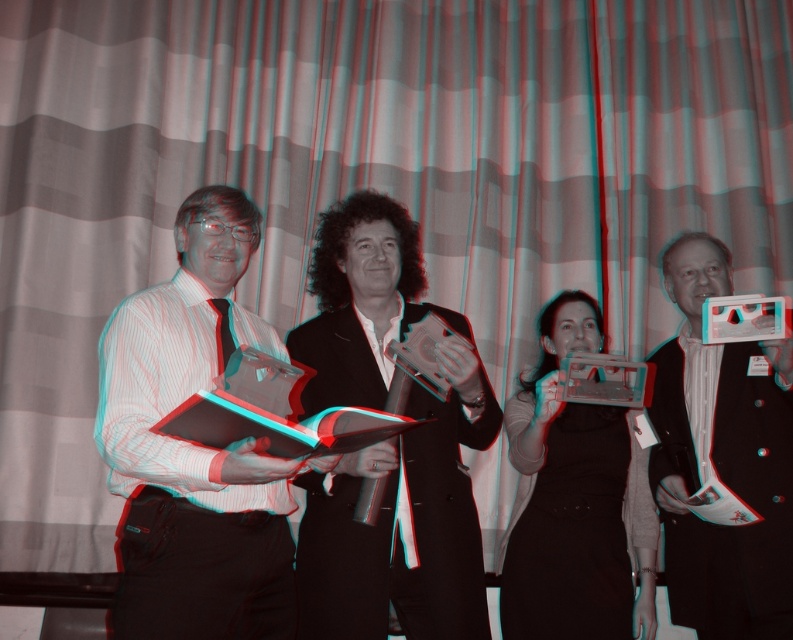
You are organizing a small exhibition and need to place the black glossy book at center and the shiny silver award at center on a shelf. Based on the image, which object should be placed to the left of the other?

The black glossy book at center should be placed to the left of the shiny silver award at center because in the image, the black glossy book at center is positioned on the left side of the shiny silver award at center.

You are organizing a photo shoot and need to ensure that the black glossy book at center and the matte black dress at center are positioned at least 20 inches apart for proper lighting. Based on the scene description, is their current distance sufficient?

The black glossy book at center is 17.21 inches away from matte black dress at center, which is less than the required 20 inches. Therefore, their current distance is insufficient for proper lighting.

You are organizing a display and need to place the black glossy book at center and the shiny silver award at center side by side on a shelf. Based on the information provided, which object should be placed first to ensure there is enough space?

The black glossy book at center should be placed first since it might be wider than the shiny silver award at center, ensuring there is sufficient space for both items on the shelf.